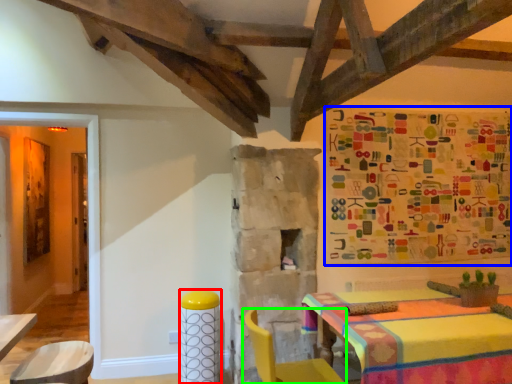
Question: Which is nearer to the bar stool (highlighted by a red box)? tapestry (highlighted by a blue box) or chair (highlighted by a green box).

Choices:
 (A) tapestry
 (B) chair

Answer: (B)